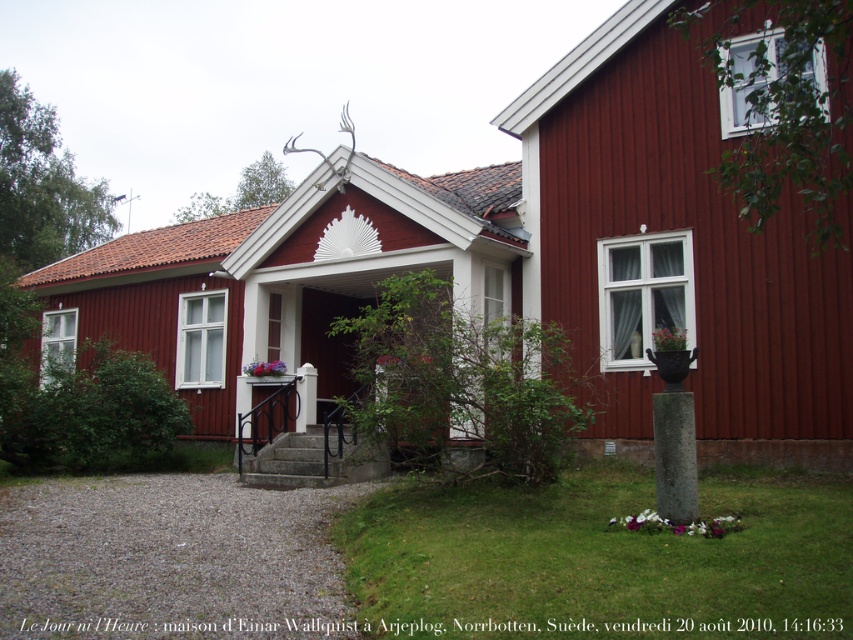
You are standing in front of the red wooden house and notice two points marked on its facade. The first point is at coordinate point (366, 461), and the second is at point (315, 417). Which point appears closer to you?

Point (366, 461) is closer to the camera than point (315, 417), so the first point appears closer to you.

You are standing at the entrance of the red wooden house and want to go up the concrete stairs at center. Is the white concrete pillar at center blocking your path?

The concrete stairs at center is positioned under white concrete pillar at center, so the pillar is directly above the stairs. This means the white concrete pillar at center is not blocking the path to the stairs, as it is located above them.

Looking at this image, you are standing at the entrance of the matte wooden cottage at center. If you walk straight ahead, will you eventually reach the decorative sunburst design above the porch?

The decorative sunburst design above the porch is part of the facade of the matte wooden cottage at center. Since you are already at the entrance of the cottage, walking straight ahead would not lead you to the sunburst design as it is located above you on the building itself.